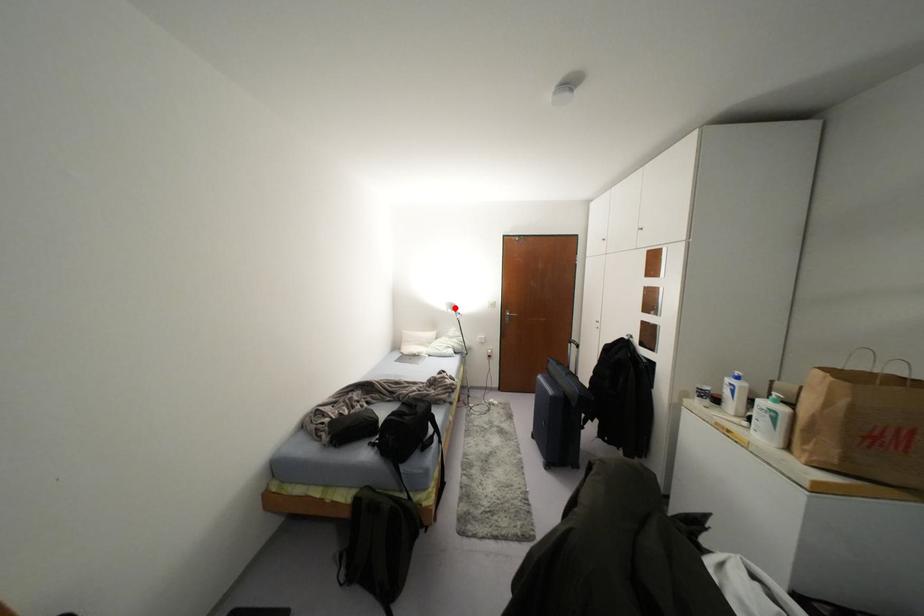
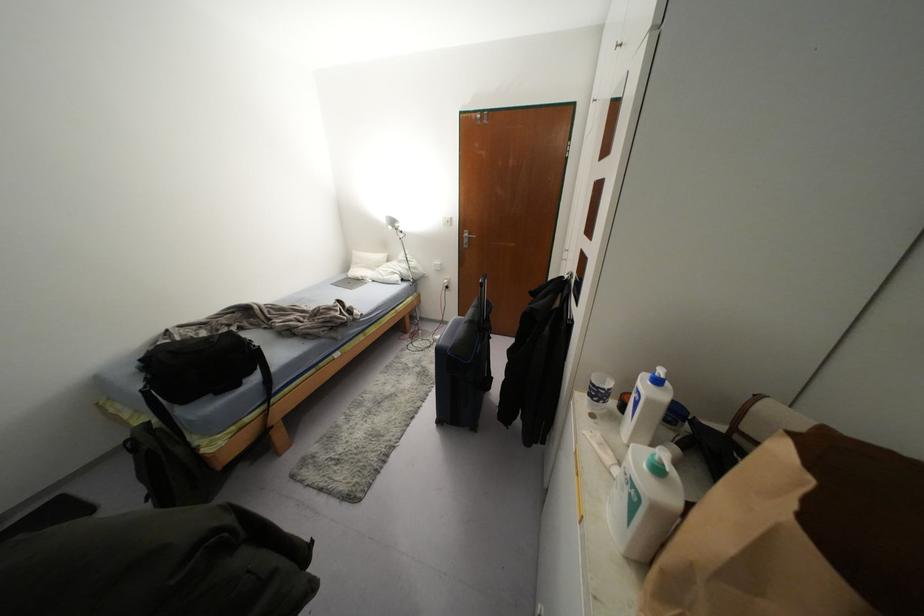
Where in the second image is the point corresponding to the highlighted location from the first image?

(395, 225)